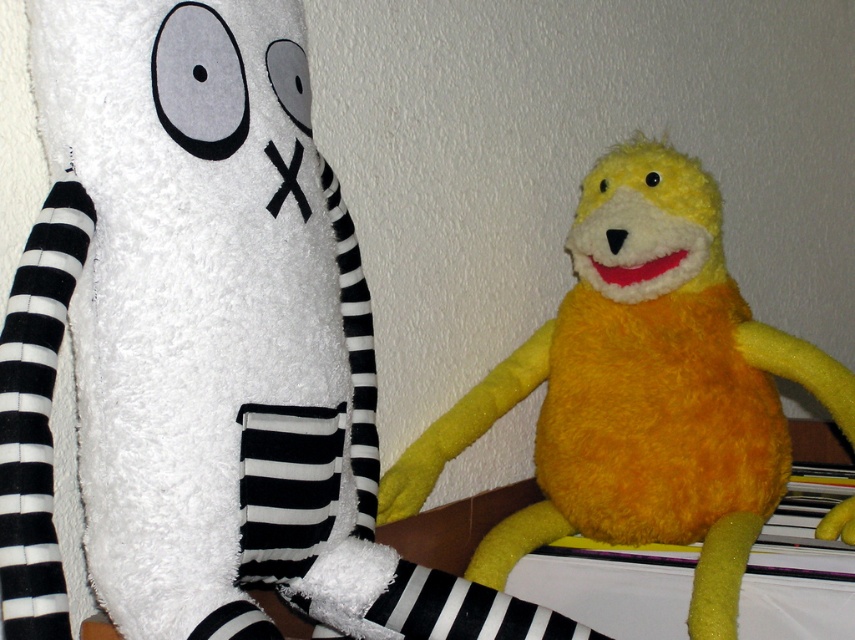
You are a child who wants to place both the yellow plush toy at right and the yellow fuzzy stuffed animal at center on a small shelf. Which one would you need to adjust the shelf height for?

The yellow plush toy at right is much taller than the yellow fuzzy stuffed animal at center, so you would need to adjust the shelf height for the yellow plush toy at right to ensure it fits properly.

You are a child trying to reach for the yellow plush toy at right and the yellow fuzzy stuffed animal at center. Which one is higher up?

The yellow plush toy at right is located above the yellow fuzzy stuffed animal at center, so it is higher up.

You are standing in front of two yellow plush toys. One is the yellow plush toy at right and the other is the yellow fuzzy stuffed animal at center. Which one do you think is nearer to you?

The yellow plush toy at right is closer to the viewer than the yellow fuzzy stuffed animal at center.